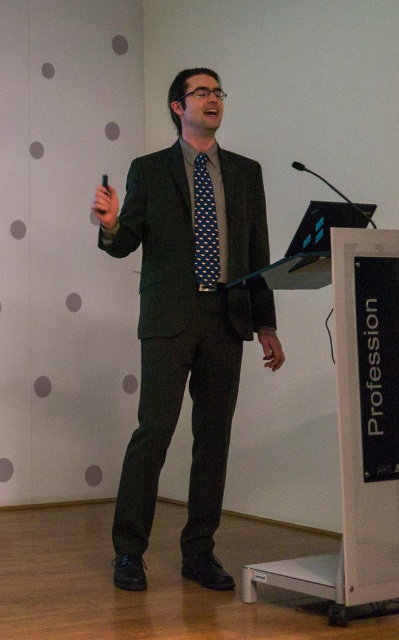
Question: Is matte black suit at center below blue dotted tie at center?

Choices:
 (A) yes
 (B) no

Answer: (A)

Question: Which of the following is the farthest from the observer?

Choices:
 (A) (189, 204)
 (B) (213, 228)

Answer: (B)

Question: Which point appears closest to the camera in this image?

Choices:
 (A) (351, 204)
 (B) (201, 250)
 (C) (221, 449)

Answer: (A)

Question: Is matte black suit at center positioned in front of black metallic microphone at upper right?

Choices:
 (A) yes
 (B) no

Answer: (A)

Question: Does blue dotted tie at center appear over black metallic microphone at upper right?

Choices:
 (A) yes
 (B) no

Answer: (B)

Question: Which of the following is the closest to the observer?

Choices:
 (A) black metallic microphone at upper right
 (B) matte black suit at center
 (C) blue dotted tie at center

Answer: (B)